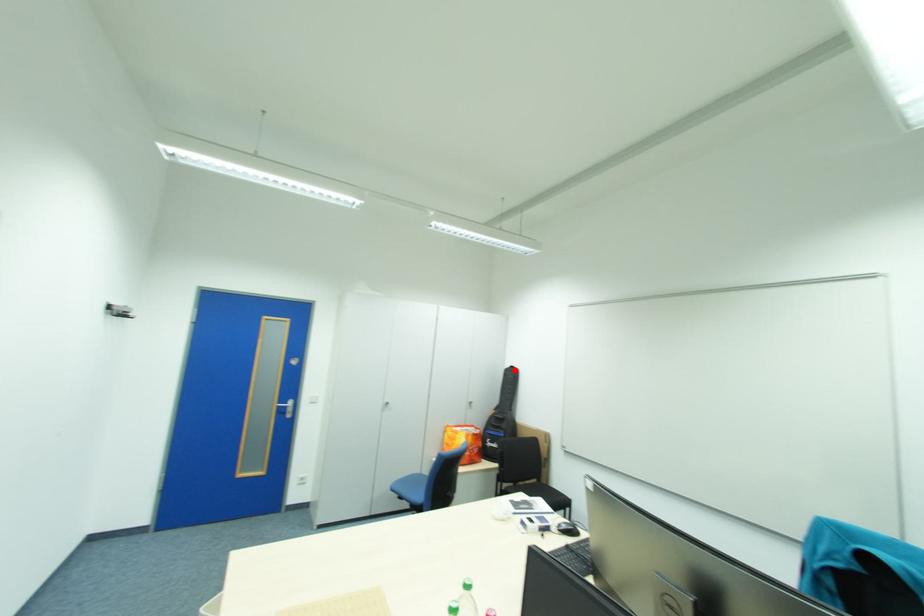
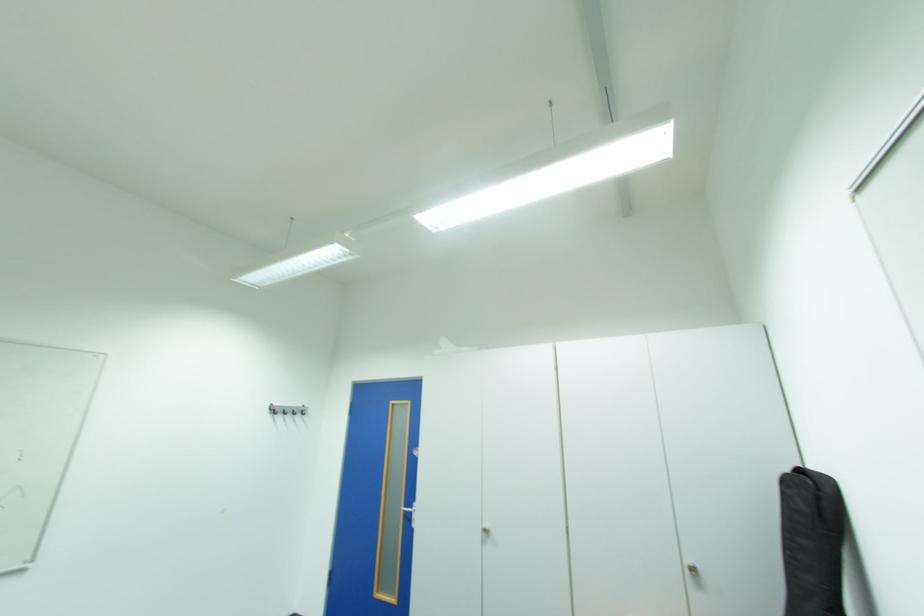
The point at the highlighted location is marked in the first image. Where is the corresponding point in the second image?

(795, 482)